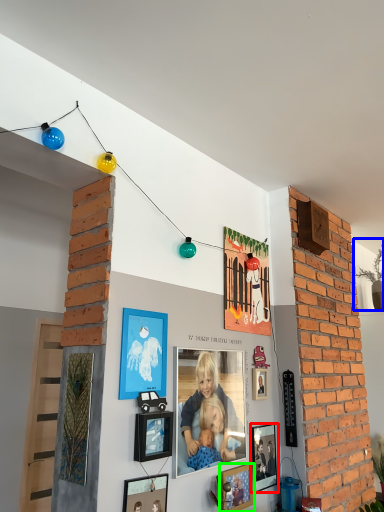
Question: Which is farther away from picture frame (highlighted by a red box)? plant (highlighted by a blue box) or picture frame (highlighted by a green box)?

Choices:
 (A) plant
 (B) picture frame

Answer: (A)